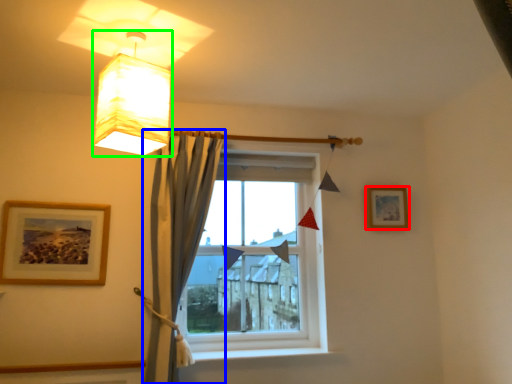
Question: Based on their relative distances, which object is nearer to picture frame (highlighted by a red box)? Choose from curtain (highlighted by a blue box) and lamp (highlighted by a green box).

Choices:
 (A) curtain
 (B) lamp

Answer: (A)